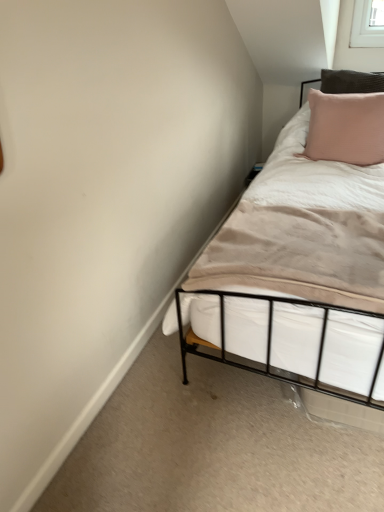
The width and height of the screenshot is (384, 512). Describe the element at coordinates (298, 243) in the screenshot. I see `white soft fabric mattress at center` at that location.

Find the location of a particular element. This screenshot has height=512, width=384. white soft fabric mattress at center is located at coordinates (298, 243).

The image size is (384, 512). Describe the element at coordinates (346, 128) in the screenshot. I see `pink textured pillow at upper right` at that location.

The width and height of the screenshot is (384, 512). Identify the location of pink textured pillow at upper right. (346, 128).

Identify the location of white soft fabric mattress at center. (298, 243).

Is pink textured pillow at upper right at the right side of white soft fabric mattress at center?

Yes.

Relative to white soft fabric mattress at center, is pink textured pillow at upper right in front or behind?

pink textured pillow at upper right is behind white soft fabric mattress at center.

Which is closer to the camera, (353, 133) or (330, 166)?

Point (353, 133) is positioned closer to the camera compared to point (330, 166).

From the image's perspective, would you say pink textured pillow at upper right is positioned over white soft fabric mattress at center?

Yes.

From a real-world perspective, is pink textured pillow at upper right physically below white soft fabric mattress at center?

Actually, pink textured pillow at upper right is physically above white soft fabric mattress at center in the real world.

In terms of width, does pink textured pillow at upper right look wider or thinner when compared to white soft fabric mattress at center?

pink textured pillow at upper right is thinner than white soft fabric mattress at center.

Considering the relative sizes of pink textured pillow at upper right and white soft fabric mattress at center in the image provided, is pink textured pillow at upper right shorter than white soft fabric mattress at center?

No.

Which of these two, pink textured pillow at upper right or white soft fabric mattress at center, is smaller?

With smaller size is white soft fabric mattress at center.

Which is correct: pink textured pillow at upper right is inside white soft fabric mattress at center, or outside of it?

pink textured pillow at upper right is not enclosed by white soft fabric mattress at center.

Are pink textured pillow at upper right and white soft fabric mattress at center far apart?

pink textured pillow at upper right is actually quite close to white soft fabric mattress at center.

Is pink textured pillow at upper right oriented towards white soft fabric mattress at center?

Yes, pink textured pillow at upper right is turned towards white soft fabric mattress at center.

How distant is pink textured pillow at upper right from white soft fabric mattress at center?

pink textured pillow at upper right and white soft fabric mattress at center are 21.43 inches apart.

Identify the location of pillow above the white soft fabric mattress at center (from the image's perspective). (346, 128).

Is white soft fabric mattress at center at the left side of pink textured pillow at upper right?

Correct, you'll find white soft fabric mattress at center to the left of pink textured pillow at upper right.

Considering the relative positions of white soft fabric mattress at center and pink textured pillow at upper right in the image provided, is white soft fabric mattress at center behind pink textured pillow at upper right?

No, white soft fabric mattress at center is closer to the viewer.

Does point (344, 243) lie in front of point (319, 106)?

That is True.

From the image's perspective, which one is positioned higher, white soft fabric mattress at center or pink textured pillow at upper right?

pink textured pillow at upper right is shown above in the image.

From a real-world perspective, which object rests below the other?

From a 3D spatial view, white soft fabric mattress at center is below.

Is white soft fabric mattress at center thinner than pink textured pillow at upper right?

No.

Is white soft fabric mattress at center taller or shorter than pink textured pillow at upper right?

Clearly, white soft fabric mattress at center is shorter compared to pink textured pillow at upper right.

Considering the sizes of objects white soft fabric mattress at center and pink textured pillow at upper right in the image provided, who is smaller, white soft fabric mattress at center or pink textured pillow at upper right?

white soft fabric mattress at center.

Choose the correct answer: Is white soft fabric mattress at center inside pink textured pillow at upper right or outside it?

white soft fabric mattress at center is located beyond the bounds of pink textured pillow at upper right.

Consider the image. Is white soft fabric mattress at center in contact with pink textured pillow at upper right?

No, white soft fabric mattress at center is not making contact with pink textured pillow at upper right.

Is white soft fabric mattress at center positioned with its back to pink textured pillow at upper right?

Yes, pink textured pillow at upper right is at the back of white soft fabric mattress at center.

How many degrees apart are the facing directions of white soft fabric mattress at center and pink textured pillow at upper right?

The angular difference between white soft fabric mattress at center and pink textured pillow at upper right is 2.05 degrees.

Find the location of a particular element. The width and height of the screenshot is (384, 512). pillow located behind the white soft fabric mattress at center is located at coordinates (346, 128).

Locate an element on the screen. The width and height of the screenshot is (384, 512). pillow that is above the white soft fabric mattress at center (from the image's perspective) is located at coordinates (346, 128).

The image size is (384, 512). In order to click on pillow located above the white soft fabric mattress at center (from a real-world perspective) in this screenshot , I will do pos(346,128).